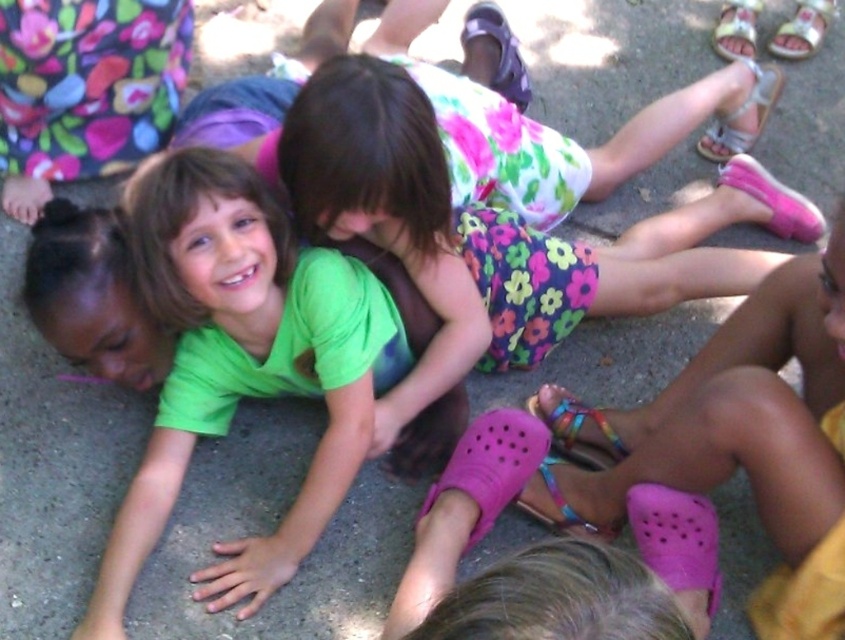
Between green matte shirt at center and yellow fabric sandal at upper right, which one appears on the left side from the viewer's perspective?

green matte shirt at center is more to the left.

Can you confirm if green matte shirt at center is wider than yellow fabric sandal at upper right?

Indeed, green matte shirt at center has a greater width compared to yellow fabric sandal at upper right.

Is point (161, 241) farther from viewer compared to point (722, 3)?

No, (161, 241) is in front of (722, 3).

Find the location of a particular element. Image resolution: width=845 pixels, height=640 pixels. green matte shirt at center is located at coordinates (240, 365).

Is point (718, 141) in front of point (502, 12)?

Yes, it is in front of point (502, 12).

Can you confirm if metallic silver sandal at upper right is thinner than purple fabric sandal at upper center?

No.

The width and height of the screenshot is (845, 640). What do you see at coordinates (742, 115) in the screenshot?
I see `metallic silver sandal at upper right` at bounding box center [742, 115].

At what (x,y) coordinates should I click in order to perform the action: click on metallic silver sandal at upper right. Please return your answer as a coordinate pair (x, y). Looking at the image, I should click on (742, 115).

This screenshot has height=640, width=845. What do you see at coordinates (576, 429) in the screenshot? I see `multicolored woven sandal at lower center` at bounding box center [576, 429].

The image size is (845, 640). What do you see at coordinates (576, 429) in the screenshot?
I see `multicolored woven sandal at lower center` at bounding box center [576, 429].

You are a GUI agent. You are given a task and a screenshot of the screen. Output one action in this format:
    pyautogui.click(x=<x>, y=<y>)
    Task: Click on the multicolored woven sandal at lower center
    
    Given the screenshot: What is the action you would take?
    pyautogui.click(x=576, y=429)